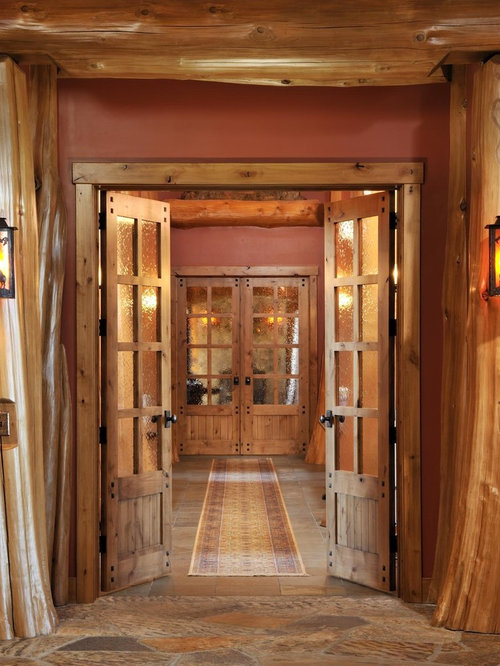
The height and width of the screenshot is (666, 500). What are the coordinates of `open doors` in the screenshot? It's located at (356, 507), (144, 507).